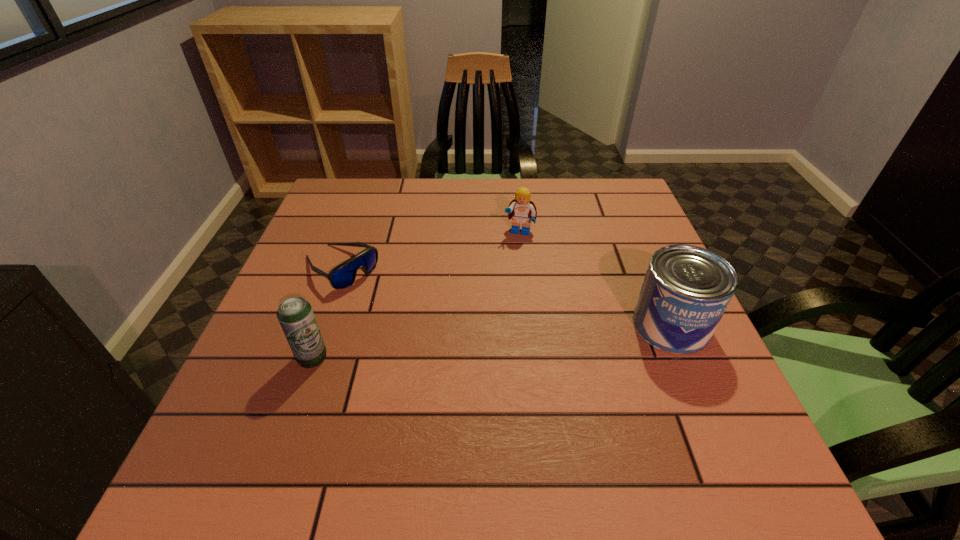
I want to click on unoccupied area between the third object from left to right and the can, so click(x=595, y=279).

I want to click on free space between the beer can and the third nearest object, so click(326, 312).

Find the location of a particular element. This screenshot has height=540, width=960. object that ranks as the second closest to the can is located at coordinates (342, 276).

Identify which object is located as the third nearest to the shortest object. Please provide its 2D coordinates. Your answer should be formatted as a tuple, i.e. [(x, y)], where the tuple contains the x and y coordinates of a point satisfying the conditions above.

[(686, 290)]

Find the location of a particular element. vacant point that satisfies the following two spatial constraints: 1. on the front side of the Lego; 2. on the front label of the can is located at coordinates (530, 325).

Find the location of a particular element. vacant space that satisfies the following two spatial constraints: 1. on the front side of the farthest object; 2. on the front label of the rightmost object is located at coordinates (530, 325).

In order to click on free space that satisfies the following two spatial constraints: 1. on the front side of the rightmost object; 2. on the front label of the second farthest object in this screenshot , I will do `click(320, 325)`.

Find the location of `free space that satisfies the following two spatial constraints: 1. on the back side of the can; 2. on the front label of the beer can`. free space that satisfies the following two spatial constraints: 1. on the back side of the can; 2. on the front label of the beer can is located at coordinates (324, 325).

The height and width of the screenshot is (540, 960). Identify the location of vacant area in the image that satisfies the following two spatial constraints: 1. on the back side of the third object from left to right; 2. on the left side of the beer can. (356, 232).

Identify the location of vacant space that satisfies the following two spatial constraints: 1. on the front side of the second object from right to left; 2. on the front label of the can. Image resolution: width=960 pixels, height=540 pixels. (530, 325).